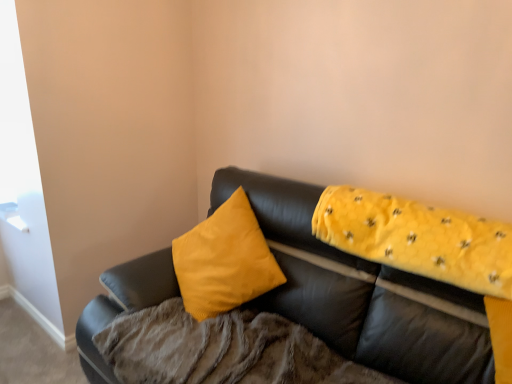
Question: Should I look upward or downward to see yellow quilted fabric at upper right?

Choices:
 (A) down
 (B) up

Answer: (A)

Question: Does soft yellow blanket at upper right appear on the right side of yellow quilted fabric at upper right?

Choices:
 (A) no
 (B) yes

Answer: (A)

Question: Is soft yellow blanket at upper right smaller than yellow quilted fabric at upper right?

Choices:
 (A) no
 (B) yes

Answer: (A)

Question: Considering the relative sizes of soft yellow blanket at upper right and yellow quilted fabric at upper right in the image provided, is soft yellow blanket at upper right wider than yellow quilted fabric at upper right?

Choices:
 (A) no
 (B) yes

Answer: (B)

Question: Is there a large distance between soft yellow blanket at upper right and yellow quilted fabric at upper right?

Choices:
 (A) yes
 (B) no

Answer: (B)

Question: From a real-world perspective, is soft yellow blanket at upper right over yellow quilted fabric at upper right?

Choices:
 (A) yes
 (B) no

Answer: (B)

Question: From the image's perspective, would you say soft yellow blanket at upper right is positioned over yellow quilted fabric at upper right?

Choices:
 (A) yes
 (B) no

Answer: (B)

Question: Is yellow quilted fabric at upper right aimed at soft yellow blanket at upper right?

Choices:
 (A) no
 (B) yes

Answer: (A)

Question: Is yellow quilted fabric at upper right smaller than soft yellow blanket at upper right?

Choices:
 (A) yes
 (B) no

Answer: (A)

Question: Is yellow quilted fabric at upper right completely or partially outside of soft yellow blanket at upper right?

Choices:
 (A) no
 (B) yes

Answer: (B)

Question: Are yellow quilted fabric at upper right and soft yellow blanket at upper right far apart?

Choices:
 (A) yes
 (B) no

Answer: (B)

Question: Does yellow quilted fabric at upper right have a greater height compared to soft yellow blanket at upper right?

Choices:
 (A) yes
 (B) no

Answer: (B)

Question: Considering the relative sizes of yellow quilted fabric at upper right and soft yellow blanket at upper right in the image provided, is yellow quilted fabric at upper right shorter than soft yellow blanket at upper right?

Choices:
 (A) yes
 (B) no

Answer: (A)

Question: Is matte black couch at center directly adjacent to yellow quilted fabric at upper right?

Choices:
 (A) yes
 (B) no

Answer: (B)